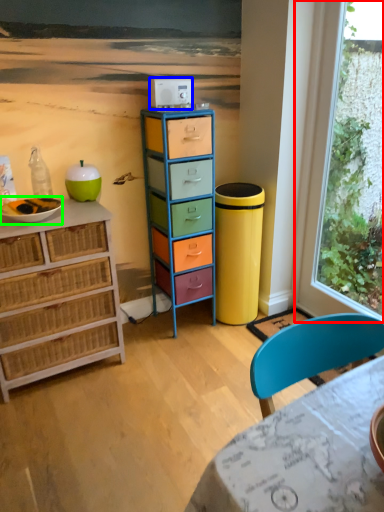
Question: Estimate the real-world distances between objects in this image. Which object is farther from window (highlighted by a red box), appliance (highlighted by a blue box) or bowl (highlighted by a green box)?

Choices:
 (A) appliance
 (B) bowl

Answer: (B)